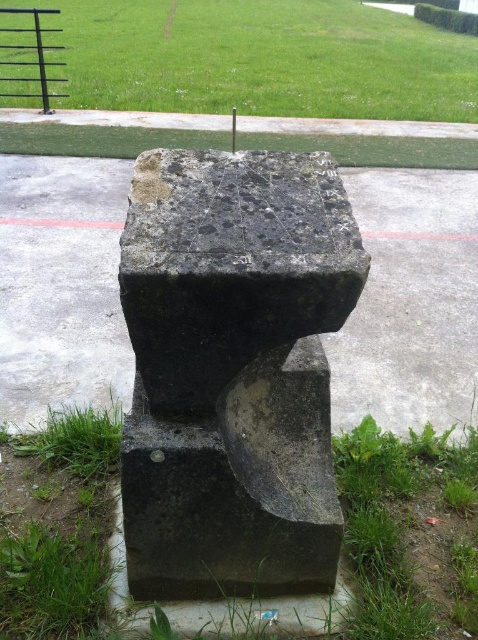
You are a gardener planning to place a new decorative stone that is 10 cm thick. You have two options for placement on the dark gray concrete at center or the green grass at upper center. Based on the scene description, which location would allow the stone to be placed without overhanging the surface?

The dark gray concrete at center is thinner than green grass at upper center. Since the decorative stone is 10 cm thick, it would fit better on the green grass at upper center, which has a larger surface area to accommodate the stone without overhanging.

You are standing in a garden and see the dark gray stone sculpture at center and the green grass at lower left. Which object is closer to you?

The dark gray stone sculpture at center is closer to you because it is in front of the green grass at lower left.